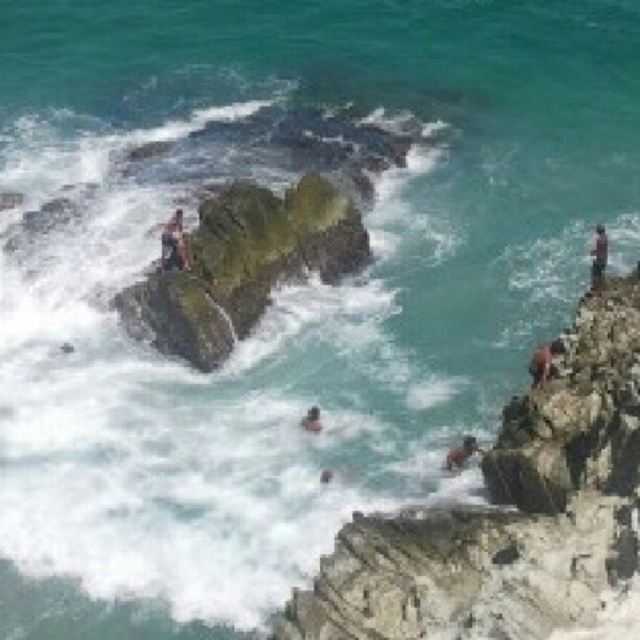
Question: Does smooth skin person at center-left appear over brown textured person at right?

Choices:
 (A) yes
 (B) no

Answer: (A)

Question: Is smooth skin person at center-left bigger than smooth skin person at right?

Choices:
 (A) no
 (B) yes

Answer: (A)

Question: Which object appears closest to the camera in this image?

Choices:
 (A) smooth tan skin at lower center
 (B) smooth skin person at right

Answer: (B)

Question: Estimate the real-world distances between objects in this image. Which object is farther from the smooth skin person at center-left?

Choices:
 (A) brown textured person at right
 (B) smooth skin person at center
 (C) smooth tan skin at lower center
 (D) smooth skin person at right

Answer: (A)

Question: Based on their relative distances, which object is nearer to the brown textured person at right?

Choices:
 (A) smooth skin person at center-left
 (B) smooth tan skin at lower center
 (C) smooth skin person at center

Answer: (B)

Question: Is brown textured person at right bigger than smooth tan skin at lower center?

Choices:
 (A) yes
 (B) no

Answer: (A)